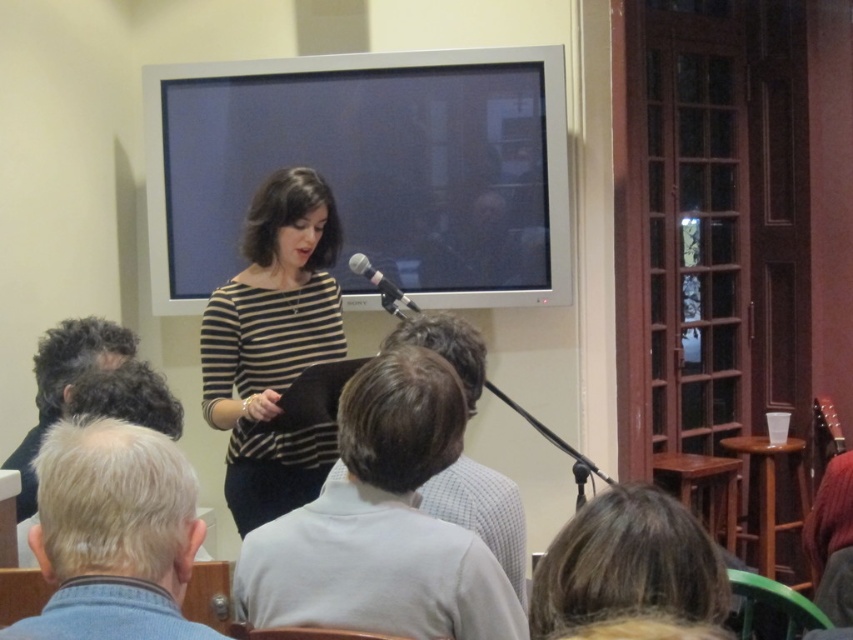
Between point (303, 323) and point (370, 280), which one is positioned in front?

Positioned in front is point (303, 323).

Identify the location of striped fabric at center. Image resolution: width=853 pixels, height=640 pixels. (273, 344).

Is point (245, 294) behind point (358, 269)?

No, (245, 294) is closer to viewer.

What are the coordinates of `striped fabric at center` in the screenshot? It's located at (273, 344).

Is brown hair at lower center bigger than dark curly hair at lower left?

No.

The image size is (853, 640). Find the location of `brown hair at lower center`. brown hair at lower center is located at coordinates (628, 564).

Which is behind, point (518, 74) or point (196, 529)?

The point (518, 74) is more distant.

Between matte black laptop at center and gray knit sweater at lower left, which one is positioned lower?

gray knit sweater at lower left

Measure the distance between matte black laptop at center and camera.

matte black laptop at center and camera are 3.03 meters apart.

Locate an element on the screen. This screenshot has width=853, height=640. matte black laptop at center is located at coordinates (369, 170).